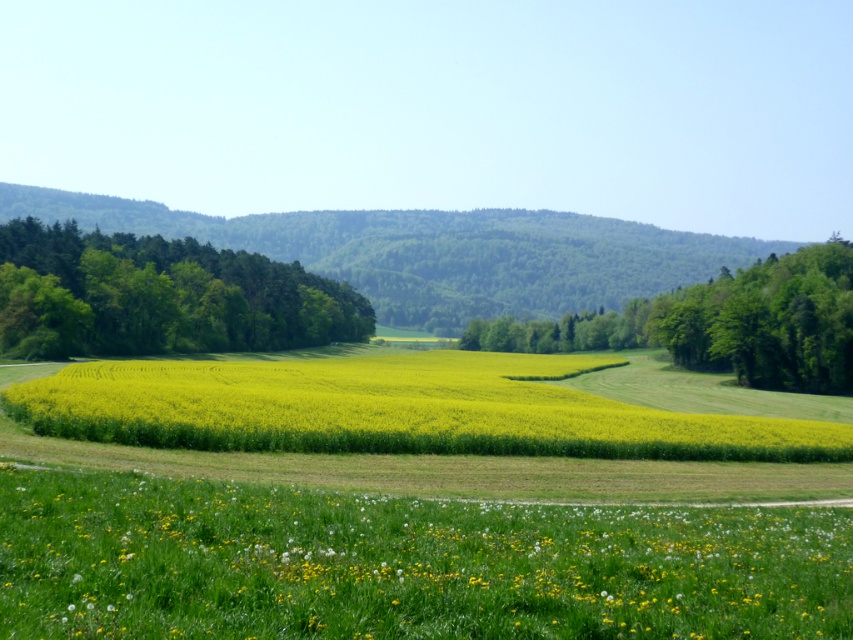
You are standing at the point marked as point (403, 564) in the image. What type of terrain are you currently standing on?

You are standing on yellow soft grass at lower center.

You are a hiker standing at the start of the dirt path in the grassy area. You want to walk towards the green leafy trees at center. Will the yellow soft grass at lower center block your path?

The yellow soft grass at lower center is in front of the green leafy trees at center, so it will block your path as you walk towards the trees.

From the picture: You are standing at the point labeled as point (160, 296) in the image. What direction should you walk to reach the green leafy trees at left?

The point labeled as point (160, 296) is where the green leafy trees at left are located, so you are already at the green leafy trees at left.